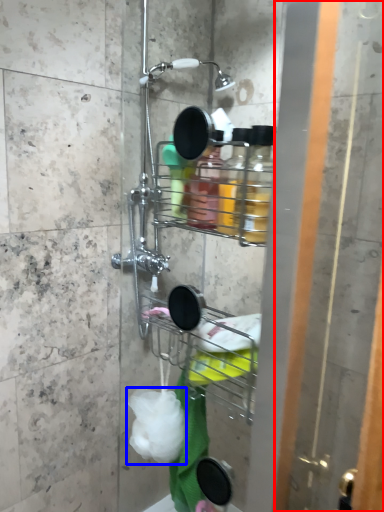
Question: Which object is closer to the camera taking this photo, screen door (highlighted by a red box) or plastic (highlighted by a blue box)?

Choices:
 (A) screen door
 (B) plastic

Answer: (A)